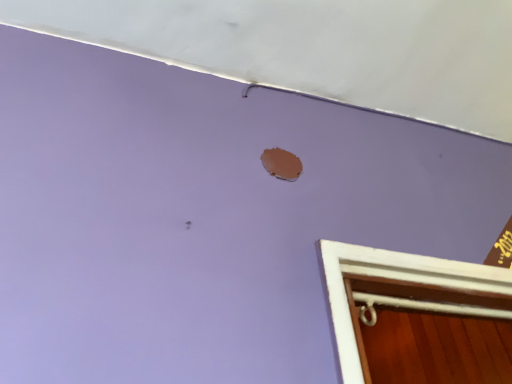
Question: From the image's perspective, is matte white exhaust hood at upper center positioned above or below matte brown hole at upper center?

Choices:
 (A) below
 (B) above

Answer: (B)

Question: Based on their sizes in the image, would you say matte white exhaust hood at upper center is bigger or smaller than matte brown hole at upper center?

Choices:
 (A) big
 (B) small

Answer: (A)

Question: Visually, is matte white exhaust hood at upper center positioned to the left or to the right of matte brown hole at upper center?

Choices:
 (A) left
 (B) right

Answer: (B)

Question: Is matte brown hole at upper center inside or outside of matte white exhaust hood at upper center?

Choices:
 (A) outside
 (B) inside

Answer: (A)

Question: Is point (273, 172) closer or farther from the camera than point (374, 51)?

Choices:
 (A) closer
 (B) farther

Answer: (A)

Question: Considering the positions of matte brown hole at upper center and matte white exhaust hood at upper center in the image, is matte brown hole at upper center taller or shorter than matte white exhaust hood at upper center?

Choices:
 (A) short
 (B) tall

Answer: (B)

Question: From a real-world perspective, relative to matte white exhaust hood at upper center, is matte brown hole at upper center vertically above or below?

Choices:
 (A) below
 (B) above

Answer: (A)